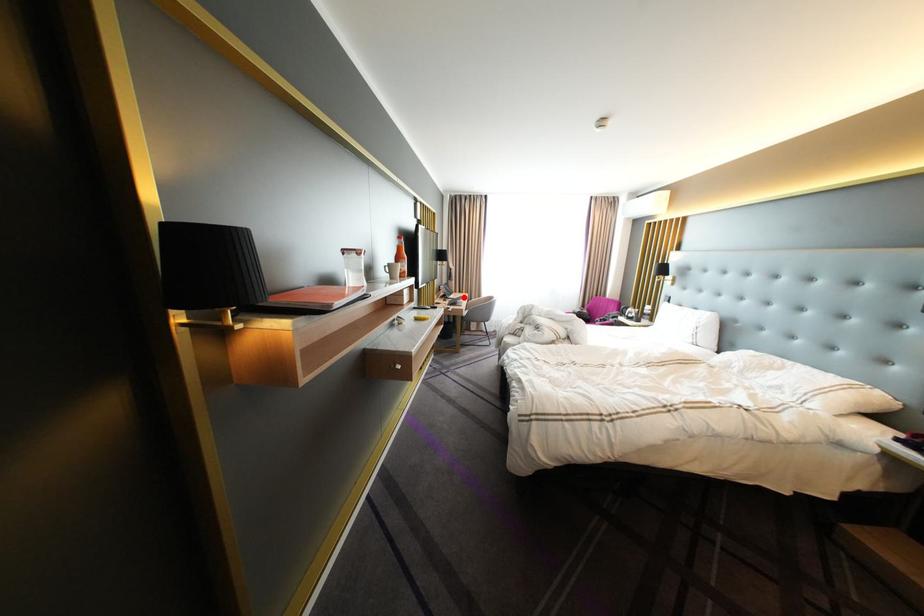
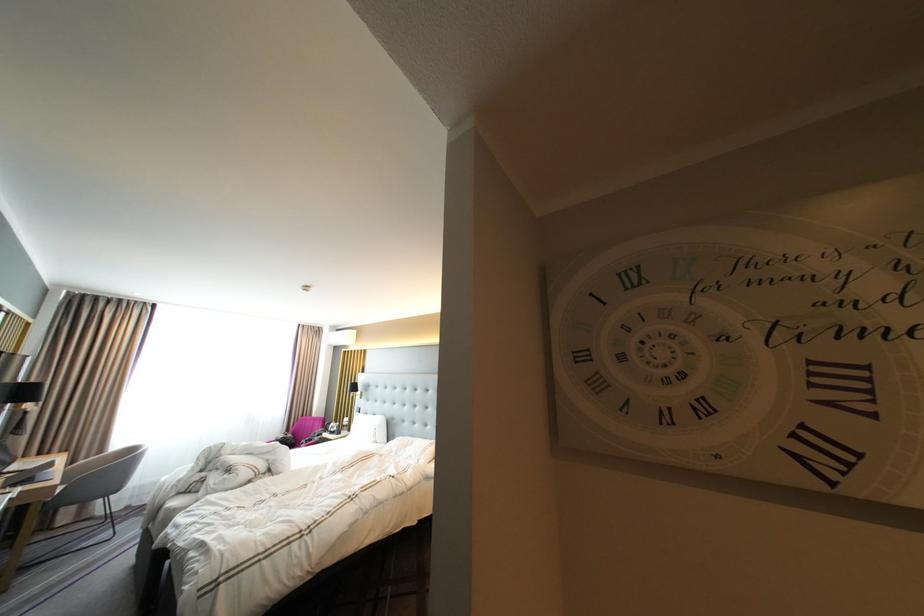
Find the pixel in the second image that matches the highlighted location in the first image.

(27, 468)